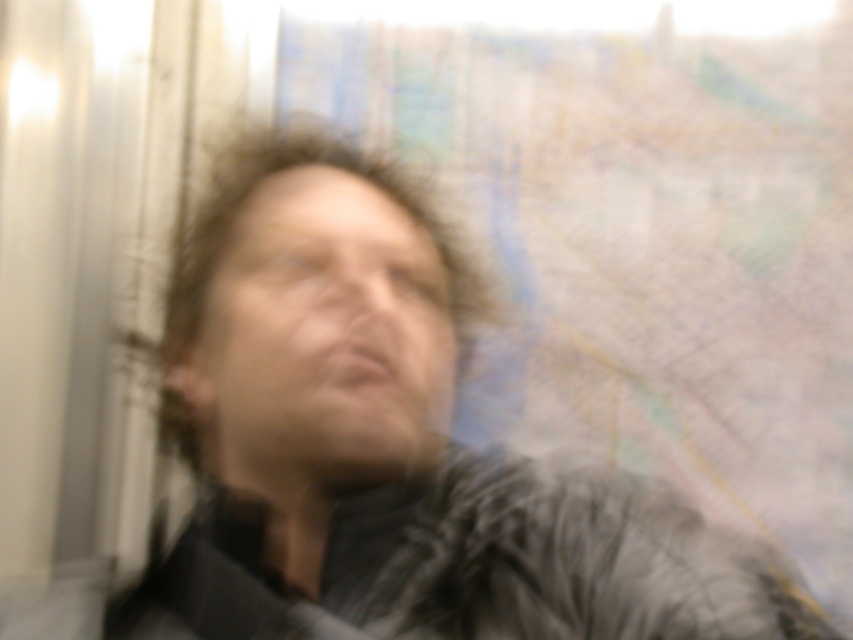
Between dark gray textured jacket at center and matte black face at center, which one appears on the right side from the viewer's perspective?

dark gray textured jacket at center

How much distance is there between dark gray textured jacket at center and matte black face at center?

The distance of dark gray textured jacket at center from matte black face at center is 4.69 inches.

Between point (733, 545) and point (244, 376), which one is positioned behind?

Positioned behind is point (733, 545).

What are the coordinates of `dark gray textured jacket at center` in the screenshot? It's located at (480, 566).

Is dark gray fur coat at center smaller than dark gray textured jacket at center?

No, dark gray fur coat at center is not smaller than dark gray textured jacket at center.

This screenshot has width=853, height=640. Find the location of `dark gray fur coat at center`. dark gray fur coat at center is located at coordinates (393, 444).

Find the location of `dark gray fur coat at center`. dark gray fur coat at center is located at coordinates (393, 444).

Is dark gray fur coat at center to the right of matte black face at center from the viewer's perspective?

Indeed, dark gray fur coat at center is positioned on the right side of matte black face at center.

Between dark gray fur coat at center and matte black face at center, which one is positioned higher?

Positioned higher is matte black face at center.

Locate an element on the screen. Image resolution: width=853 pixels, height=640 pixels. dark gray fur coat at center is located at coordinates (393, 444).